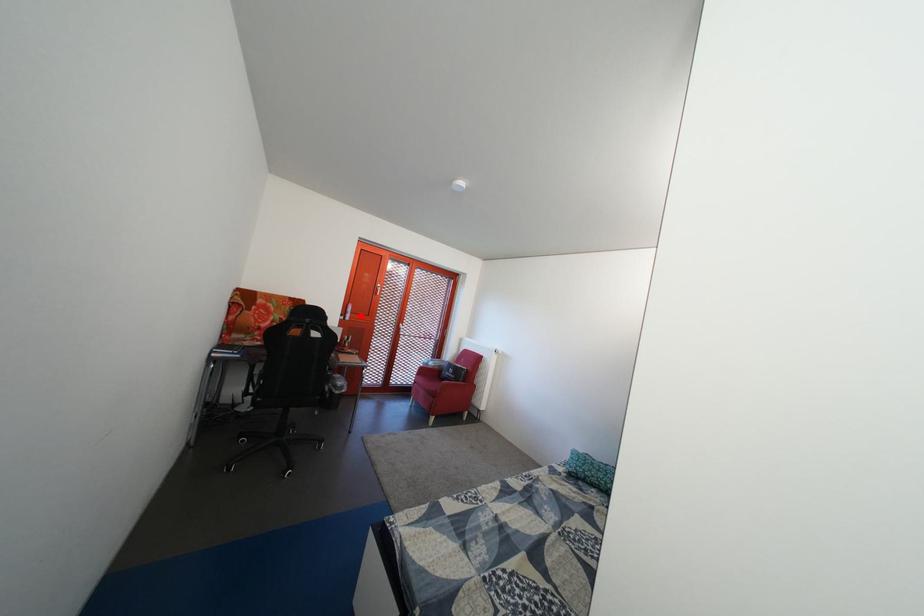
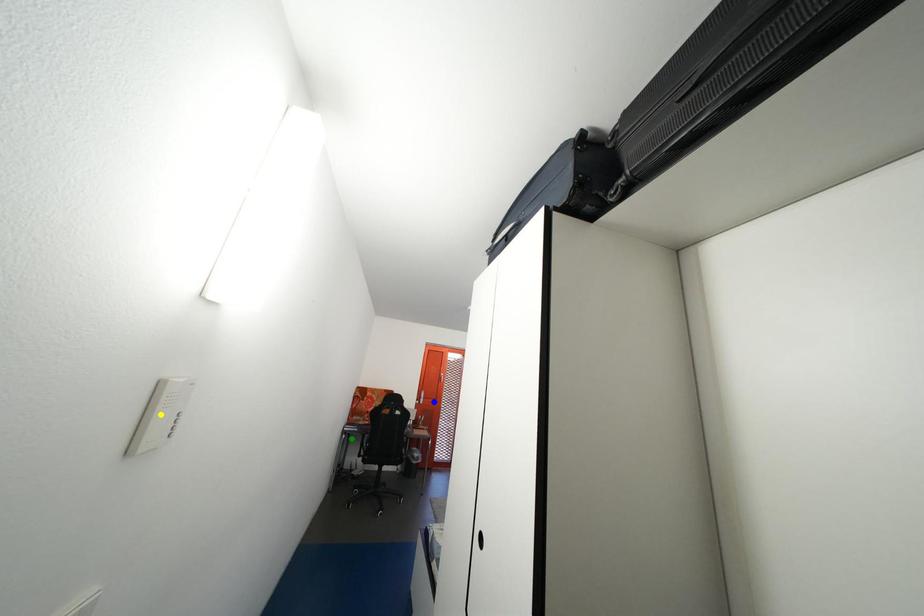
Question: I am providing you with two images of the same scene from different viewpoints. A red point is marked on the first image. You are given multiple points on the second image. In image 2, which mark is for the same physical point as the one in image 1?

Choices:
 (A) yellow point
 (B) green point
 (C) blue point

Answer: (C)